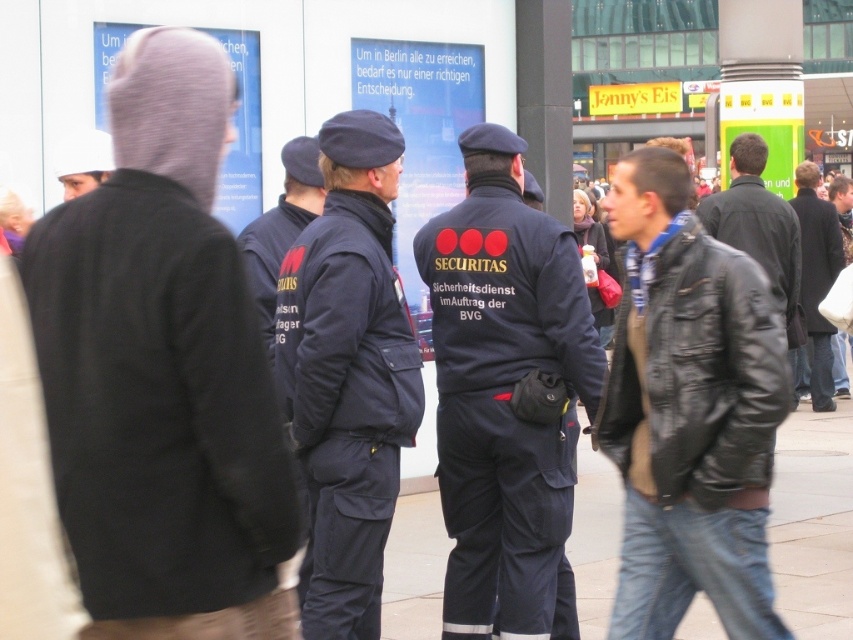
Question: Based on their relative distances, which object is farther from the dark brown leather jacket at right?

Choices:
 (A) knit gray beanie at upper left
 (B) leather jacket at center

Answer: (A)

Question: Can you confirm if leather jacket at center is positioned to the left of smooth concrete pavement at center?

Choices:
 (A) yes
 (B) no

Answer: (A)

Question: Can you confirm if knit gray beanie at upper left is smaller than white fabric cap at upper left?

Choices:
 (A) yes
 (B) no

Answer: (B)

Question: In this image, where is dark blue uniform at center located relative to black leather jacket at right?

Choices:
 (A) above
 (B) below

Answer: (B)

Question: Among these points, which one is farthest from the camera?

Choices:
 (A) (790, 428)
 (B) (828, 396)

Answer: (B)

Question: Considering the real-world distances, which object is farthest from the dark brown leather jacket at right?

Choices:
 (A) knit gray beanie at upper left
 (B) leather jacket at center

Answer: (A)